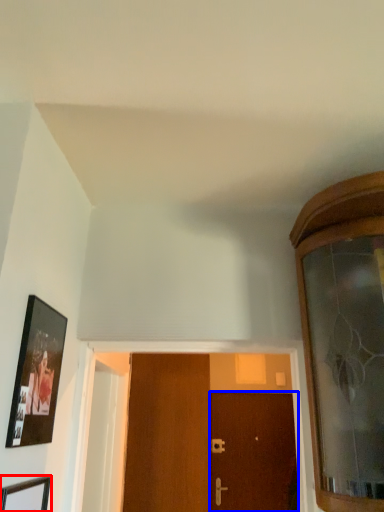
Question: Which of the following is the closest to the observer, picture frame (highlighted by a red box) or door (highlighted by a blue box)?

Choices:
 (A) picture frame
 (B) door

Answer: (A)